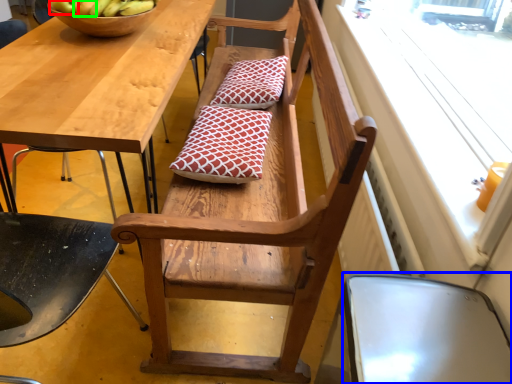
Question: Considering the real-world distances, which object is closest to apple (highlighted by a red box)? chair (highlighted by a blue box) or apple (highlighted by a green box).

Choices:
 (A) chair
 (B) apple

Answer: (B)